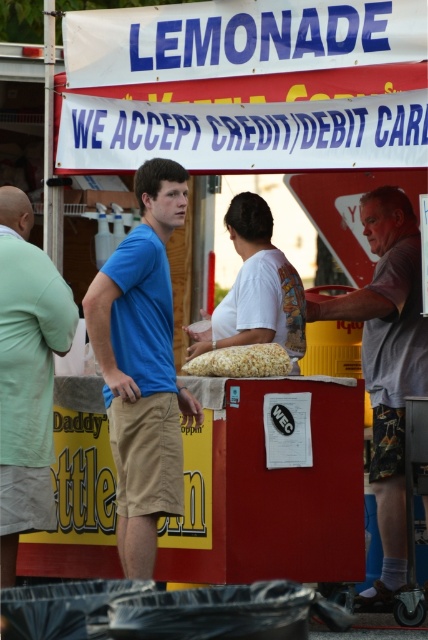
Question: Which of the following is the closest to the observer?

Choices:
 (A) white matte t-shirt at center
 (B) golden popcorn at center
 (C) gray fabric shorts at right

Answer: (B)

Question: Which of the following is the closest to the observer?

Choices:
 (A) (148, 369)
 (B) (27, 365)
 (C) (326, 308)
 (D) (184, 371)

Answer: (A)

Question: Is light green cotton shirt at left below golden popcorn at center?

Choices:
 (A) no
 (B) yes

Answer: (B)

Question: Can you confirm if gray fabric shorts at right is thinner than light green cotton shirt at left?

Choices:
 (A) yes
 (B) no

Answer: (B)

Question: Is gray fabric shorts at right to the left of golden popcorn at center from the viewer's perspective?

Choices:
 (A) no
 (B) yes

Answer: (A)

Question: Which object is the farthest from the golden popcorn at center?

Choices:
 (A) gray fabric shorts at right
 (B) blue cotton shirt at left
 (C) light green cotton shirt at left

Answer: (C)